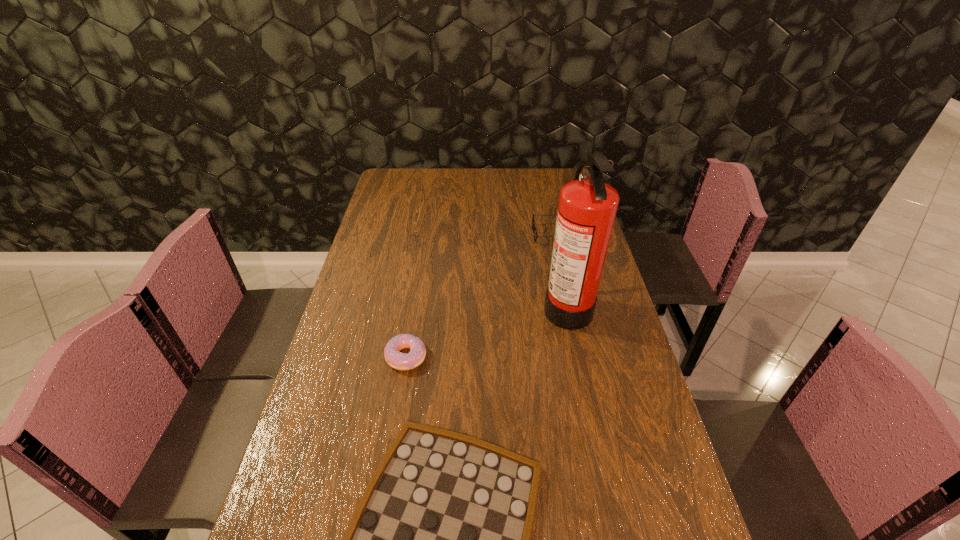
The image size is (960, 540). What are the coordinates of `the tallest object` in the screenshot? It's located at (587, 206).

Identify the location of the third nearest object. (587, 206).

This screenshot has height=540, width=960. I want to click on spectacles, so click(533, 223).

In order to click on the third farthest object in this screenshot , I will do `click(401, 361)`.

Where is `vacant area situated on the front-facing side of the third nearest object`? This screenshot has width=960, height=540. vacant area situated on the front-facing side of the third nearest object is located at coordinates (450, 305).

Where is `vacant space located on the front-facing side of the third nearest object`? The image size is (960, 540). vacant space located on the front-facing side of the third nearest object is located at coordinates (524, 305).

Identify the location of free spot located 0.160m on the front-facing side of the third nearest object. The height and width of the screenshot is (540, 960). (492, 305).

Locate an element on the screen. The image size is (960, 540). free space located 0.310m through the lenses of the farthest object is located at coordinates pos(449,234).

You are a GUI agent. You are given a task and a screenshot of the screen. Output one action in this format:
    pyautogui.click(x=<x>, y=<y>)
    Task: Click on the free space located 0.170m through the lenses of the farthest object
    The width and height of the screenshot is (960, 540).
    Given the screenshot: What is the action you would take?
    pyautogui.click(x=487, y=234)

Where is `vacant space located 0.310m through the lenses of the farthest object`? Image resolution: width=960 pixels, height=540 pixels. vacant space located 0.310m through the lenses of the farthest object is located at coordinates click(449, 234).